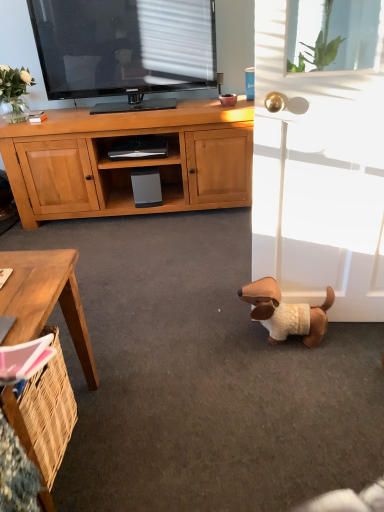
Locate an element on the screen. The height and width of the screenshot is (512, 384). free spot to the right of brown plush dog at lower right is located at coordinates (356, 341).